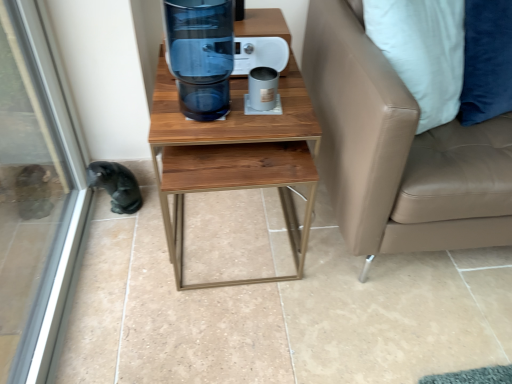
Question: Should I look upward or downward to see tan leather couch at right?

Choices:
 (A) up
 (B) down

Answer: (A)

Question: Is transparent glass water cooler at center further to camera compared to wooden table at center?

Choices:
 (A) no
 (B) yes

Answer: (A)

Question: Would you consider transparent glass water cooler at center to be distant from wooden table at center?

Choices:
 (A) no
 (B) yes

Answer: (A)

Question: Is transparent glass water cooler at center located outside wooden table at center?

Choices:
 (A) yes
 (B) no

Answer: (A)

Question: Are transparent glass water cooler at center and wooden table at center making contact?

Choices:
 (A) no
 (B) yes

Answer: (A)

Question: Is transparent glass water cooler at center positioned with its back to wooden table at center?

Choices:
 (A) yes
 (B) no

Answer: (B)

Question: Does transparent glass water cooler at center have a greater height compared to wooden table at center?

Choices:
 (A) no
 (B) yes

Answer: (A)

Question: From a real-world perspective, is transparent glass water cooler at center physically below tan leather couch at right?

Choices:
 (A) yes
 (B) no

Answer: (B)

Question: From the image's perspective, does transparent glass water cooler at center appear lower than tan leather couch at right?

Choices:
 (A) yes
 (B) no

Answer: (B)

Question: Can you see transparent glass water cooler at center touching tan leather couch at right?

Choices:
 (A) yes
 (B) no

Answer: (B)

Question: Is transparent glass water cooler at center thinner than tan leather couch at right?

Choices:
 (A) no
 (B) yes

Answer: (B)

Question: Is transparent glass water cooler at center closer to camera compared to tan leather couch at right?

Choices:
 (A) no
 (B) yes

Answer: (A)

Question: Is transparent glass water cooler at center looking in the opposite direction of tan leather couch at right?

Choices:
 (A) no
 (B) yes

Answer: (A)

Question: Is tan leather couch at right oriented away from transparent glass screen door at lower left?

Choices:
 (A) no
 (B) yes

Answer: (A)